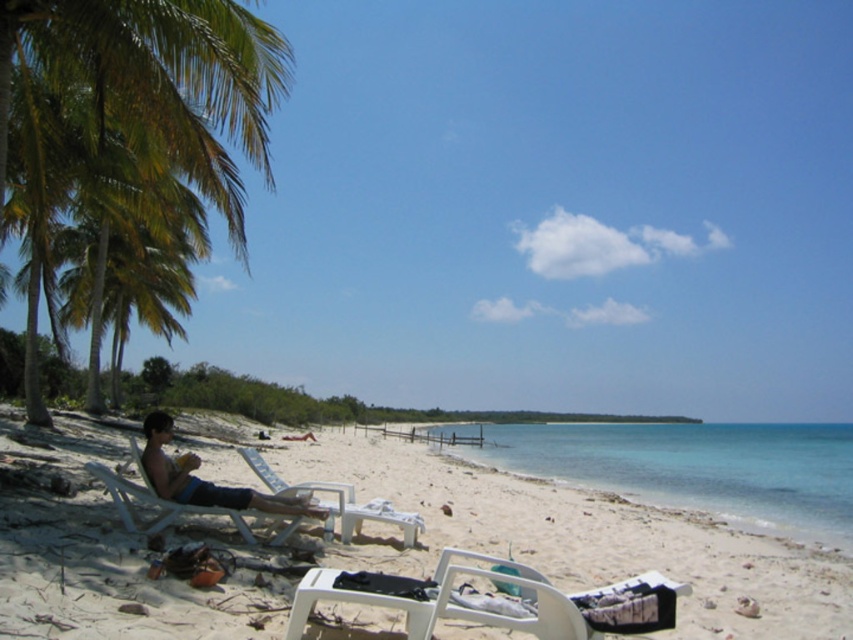
Question: Does white sandy beach at lower left appear over matte black lounge chair at lower left?

Choices:
 (A) yes
 (B) no

Answer: (B)

Question: Can you confirm if green leafy palm tree at left is smaller than clear blue water at lower center?

Choices:
 (A) no
 (B) yes

Answer: (B)

Question: Which object is closer to the camera taking this photo?

Choices:
 (A) matte black lounge chair at lower left
 (B) clear blue water at lower center
 (C) green leafy palm tree at left

Answer: (A)

Question: Which of the following is the closest to the observer?

Choices:
 (A) (187, 452)
 (B) (265, 515)
 (C) (265, 468)
 (D) (776, 451)

Answer: (B)

Question: In this image, where is white plastic chair at left located relative to white plastic chair at center?

Choices:
 (A) above
 (B) below

Answer: (A)

Question: Which object appears closest to the camera in this image?

Choices:
 (A) white plastic beach chair at lower center
 (B) matte black lounge chair at lower left

Answer: (A)